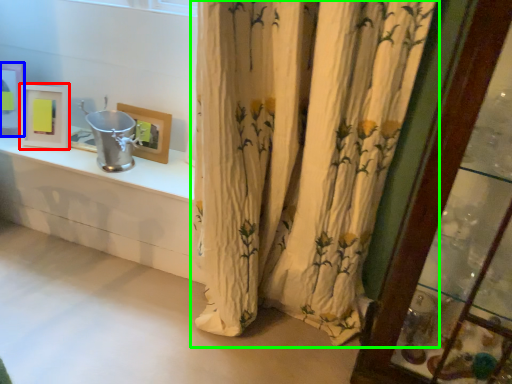
Question: Which object is the closest to the picture frame (highlighted by a red box)? Choose among these: picture frame (highlighted by a blue box) or curtain (highlighted by a green box).

Choices:
 (A) picture frame
 (B) curtain

Answer: (A)